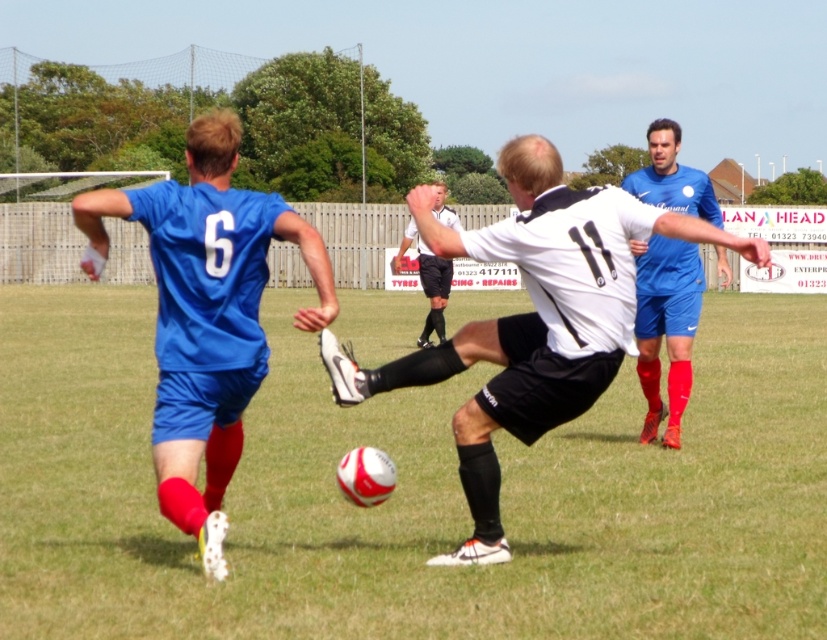
What do you see at coordinates (412, 493) in the screenshot?
I see `green grass football field at center` at bounding box center [412, 493].

Between point (417, 476) and point (238, 337), which one is positioned in front?

Point (238, 337)

The image size is (827, 640). I want to click on green grass football field at center, so click(412, 493).

Which is above, matte blue jersey at left or white smooth referee at center?

matte blue jersey at left is above.

In the scene shown: Does matte blue jersey at left have a lesser width compared to white smooth referee at center?

In fact, matte blue jersey at left might be wider than white smooth referee at center.

What do you see at coordinates (206, 314) in the screenshot?
I see `matte blue jersey at left` at bounding box center [206, 314].

Where is `matte blue jersey at left`? Image resolution: width=827 pixels, height=640 pixels. matte blue jersey at left is located at coordinates (206, 314).

Based on the photo, does green grass football field at center have a larger size compared to white smooth referee at center?

Actually, green grass football field at center might be smaller than white smooth referee at center.

The image size is (827, 640). In order to click on green grass football field at center in this screenshot , I will do `click(412, 493)`.